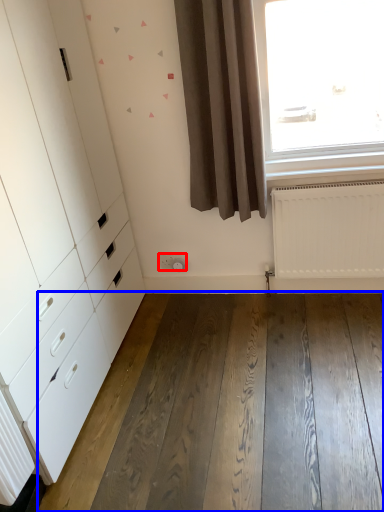
Question: Which object is closer to the camera taking this photo, electric outlet (highlighted by a red box) or hardwood (highlighted by a blue box)?

Choices:
 (A) electric outlet
 (B) hardwood

Answer: (B)